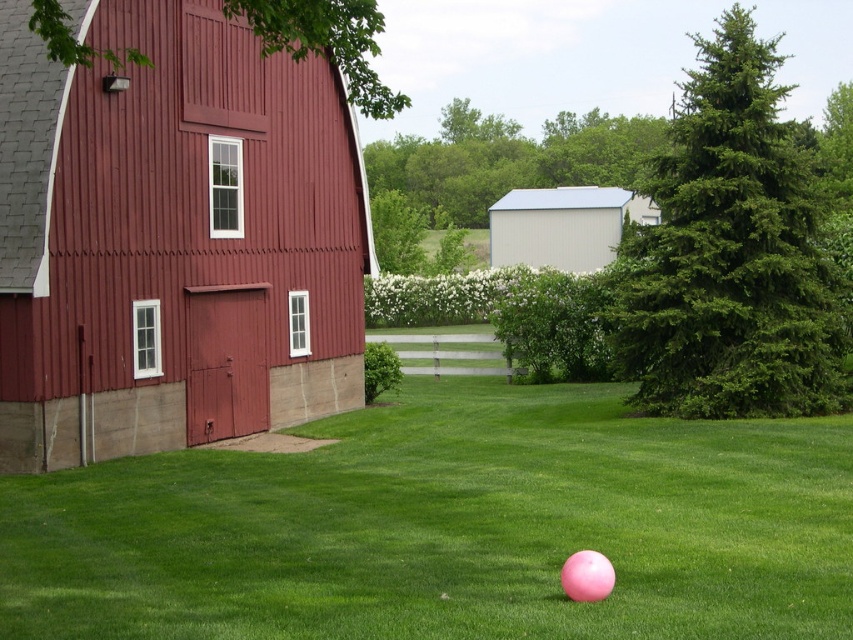
You are standing in the rural scene with the classic red barn. You see two points marked in the image. Which point is closer to you, point (514, 250) or point (595, 588)?

Point (514, 250) is closer to you than point (595, 588).

You are standing in the middle of the green lawn and see the smooth red barn at center and the white matte shed at center. Which structure is closer to you?

The smooth red barn at center is closer to you because it is positioned below the white matte shed at center, indicating it is nearer in the scene.

You are standing in the middle of the green grass at center and want to reach the white matte shed at center. Which direction should you move to get closer to the shed?

Since the green grass at center is closer to the viewer than the white matte shed at center, you should move backward to get closer to the shed.